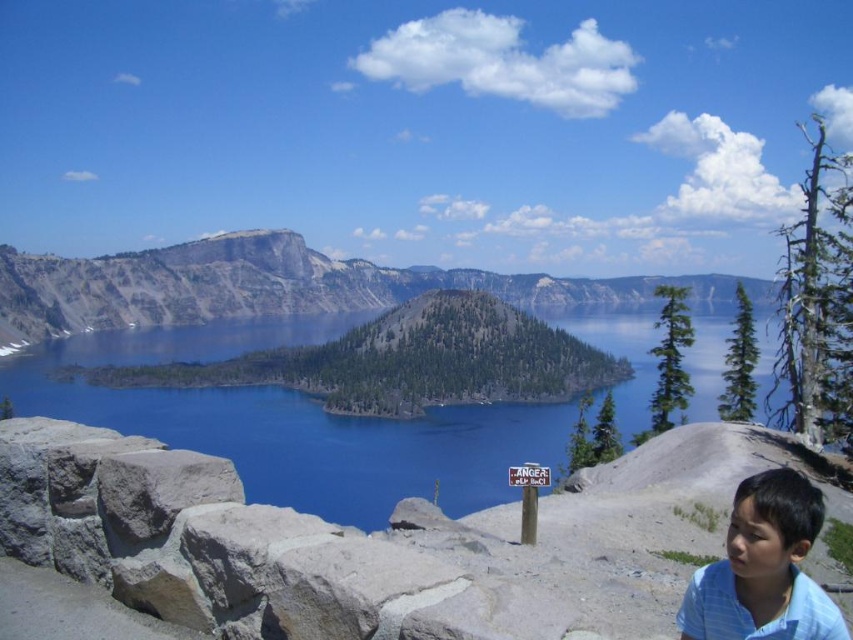
Question: Among these objects, which one is nearest to the camera?

Choices:
 (A) blue striped shirt at lower right
 (B) gray rock formation at center

Answer: (A)

Question: Is gray rock formation at center positioned in front of blue striped shirt at lower right?

Choices:
 (A) no
 (B) yes

Answer: (A)

Question: Is gray rock formation at center positioned behind blue striped shirt at lower right?

Choices:
 (A) yes
 (B) no

Answer: (A)

Question: Considering the relative positions of gray rock formation at center and blue striped shirt at lower right in the image provided, where is gray rock formation at center located with respect to blue striped shirt at lower right?

Choices:
 (A) above
 (B) below

Answer: (A)